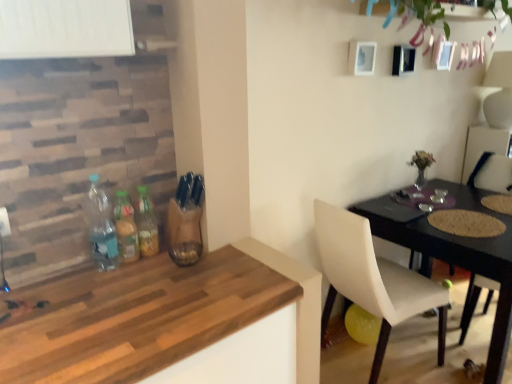
I want to click on vacant point to the right of transparent plastic bottle at left, arranged as the first bottle when viewed from the left, so click(x=157, y=274).